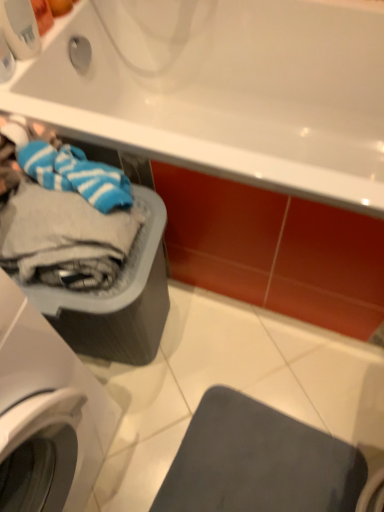
Locate an element on the screen. This screenshot has width=384, height=512. vacant space behind matte gray mat at lower right is located at coordinates (248, 355).